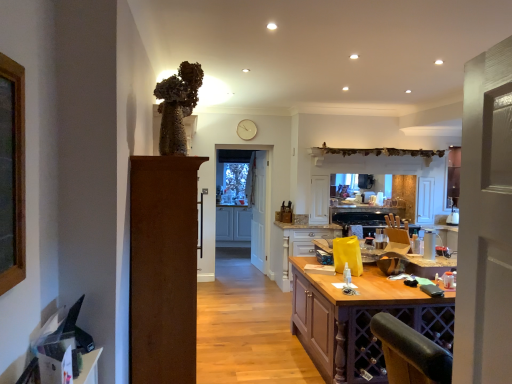
Question: Does clear glass door at center lie in front of white wooden door at center, acting as the second door starting from the left?

Choices:
 (A) no
 (B) yes

Answer: (B)

Question: Is clear glass door at center not close to white wooden door at center, acting as the second door starting from the left?

Choices:
 (A) yes
 (B) no

Answer: (B)

Question: Is clear glass door at center shorter than white wooden door at center, the first door when ordered from right to left?

Choices:
 (A) no
 (B) yes

Answer: (A)

Question: Can you confirm if clear glass door at center is taller than white wooden door at center, the first door when ordered from right to left?

Choices:
 (A) no
 (B) yes

Answer: (B)

Question: Is clear glass door at center placed right next to white wooden door at center, acting as the second door starting from the left?

Choices:
 (A) no
 (B) yes

Answer: (A)

Question: Based on their sizes in the image, would you say white plastic spray bottle at center is bigger or smaller than brown wood door at left, arranged as the first door when viewed from the front?

Choices:
 (A) small
 (B) big

Answer: (A)

Question: Is white plastic spray bottle at center wider or thinner than brown wood door at left, marked as the 1th door in a left-to-right arrangement?

Choices:
 (A) wide
 (B) thin

Answer: (B)

Question: Is white plastic spray bottle at center inside the boundaries of brown wood door at left, the second door from the back, or outside?

Choices:
 (A) inside
 (B) outside

Answer: (B)

Question: From a real-world perspective, relative to brown wood door at left, arranged as the first door when viewed from the front, is white plastic spray bottle at center vertically above or below?

Choices:
 (A) below
 (B) above

Answer: (B)

Question: Considering their positions, is white glossy cabinets at center, which is the second cabinetry in front-to-back order, located in front of or behind white wooden door at center, marked as the 2th door in a front-to-back arrangement?

Choices:
 (A) front
 (B) behind

Answer: (B)

Question: In terms of size, does white glossy cabinets at center, which appears as the first cabinetry when viewed from the back, appear bigger or smaller than white wooden door at center, acting as the second door starting from the left?

Choices:
 (A) big
 (B) small

Answer: (A)

Question: Is white glossy cabinets at center, which is the second cabinetry in front-to-back order, to the left or to the right of white wooden door at center, the first door viewed from the back, in the image?

Choices:
 (A) right
 (B) left

Answer: (B)

Question: From the image's perspective, is white glossy cabinets at center, which appears as the first cabinetry when viewed from the back, above or below white wooden door at center, acting as the second door starting from the left?

Choices:
 (A) above
 (B) below

Answer: (B)

Question: Relative to clear glass door at center, is white glossy cabinets at center, which appears as the first cabinetry when viewed from the back, in front or behind?

Choices:
 (A) behind
 (B) front

Answer: (A)

Question: Is white glossy cabinets at center, which appears as the first cabinetry when viewed from the back, inside the boundaries of clear glass door at center, or outside?

Choices:
 (A) inside
 (B) outside

Answer: (B)